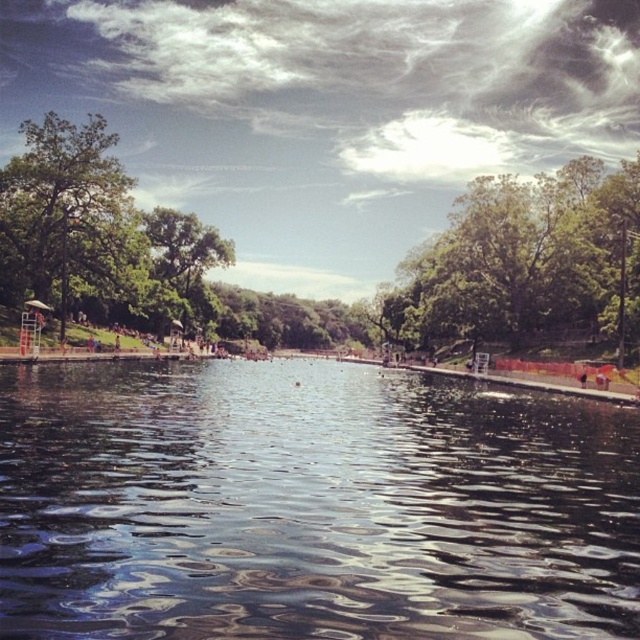
Is green leafy tree at upper center taller than green leafy tree at left?

No.

Can you confirm if green leafy tree at upper center is positioned to the left of green leafy tree at left?

Incorrect, green leafy tree at upper center is not on the left side of green leafy tree at left.

Is point (492, 260) behind point (4, 269)?

Yes, it is.

Locate an element on the screen. green leafy tree at upper center is located at coordinates (524, 260).

Which of these two, transparent water at center or green leafy tree at upper center, stands shorter?

transparent water at center is shorter.

Between transparent water at center and green leafy tree at upper center, which one appears on the right side from the viewer's perspective?

From the viewer's perspective, green leafy tree at upper center appears more on the right side.

Between point (458, 419) and point (481, 179), which one is positioned in front?

Point (458, 419)

I want to click on transparent water at center, so click(308, 506).

Between point (56, 636) and point (124, 230), which one is positioned behind?

The point (124, 230) is behind.

The width and height of the screenshot is (640, 640). What do you see at coordinates (308, 506) in the screenshot?
I see `transparent water at center` at bounding box center [308, 506].

Locate an element on the screen. The height and width of the screenshot is (640, 640). transparent water at center is located at coordinates (308, 506).